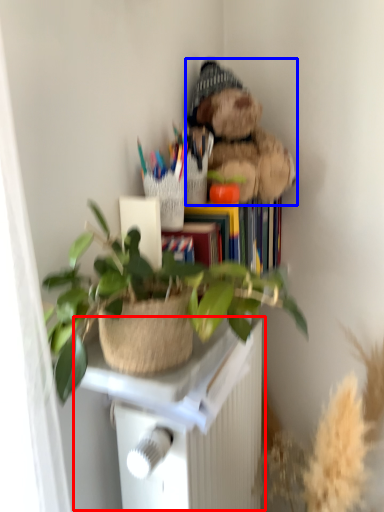
Question: Which of the following is the farthest to the observer, table (highlighted by a red box) or teddy bear (highlighted by a blue box)?

Choices:
 (A) table
 (B) teddy bear

Answer: (B)